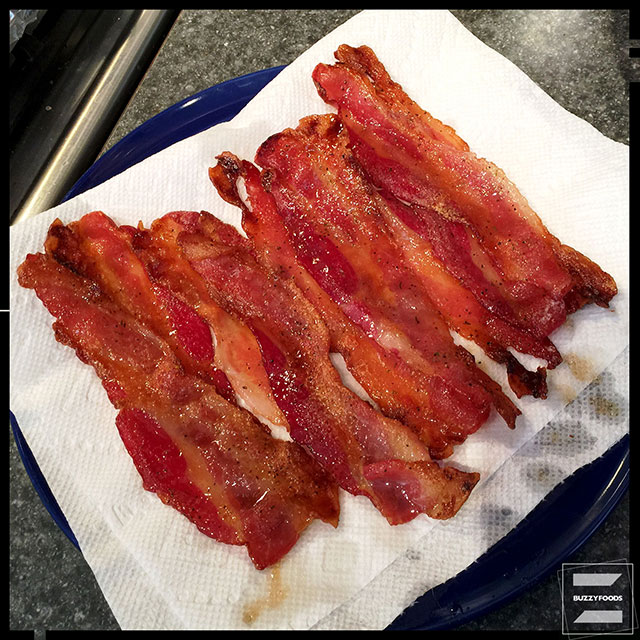
This screenshot has height=640, width=640. In order to click on paper towel in this screenshot , I will do `click(281, 586)`.